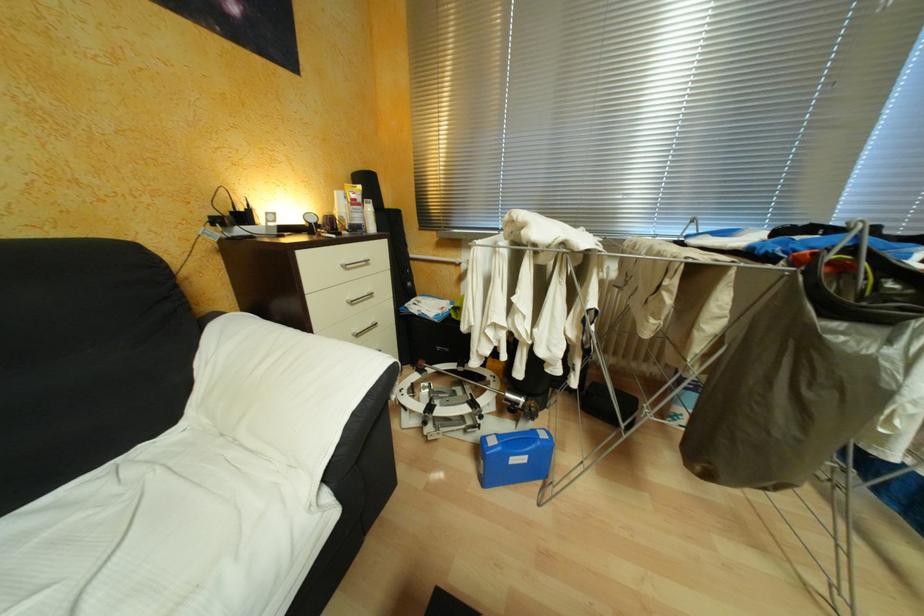
Find the location of a particular element. Image resolution: width=924 pixels, height=616 pixels. sofa armrest is located at coordinates (278, 387).